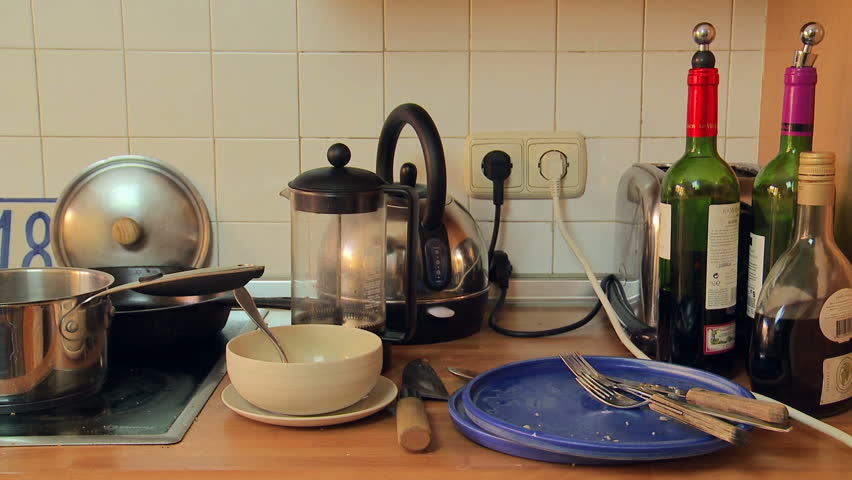
Image resolution: width=852 pixels, height=480 pixels. What are the coordinates of `forks` in the screenshot? It's located at (606, 397), (584, 363).